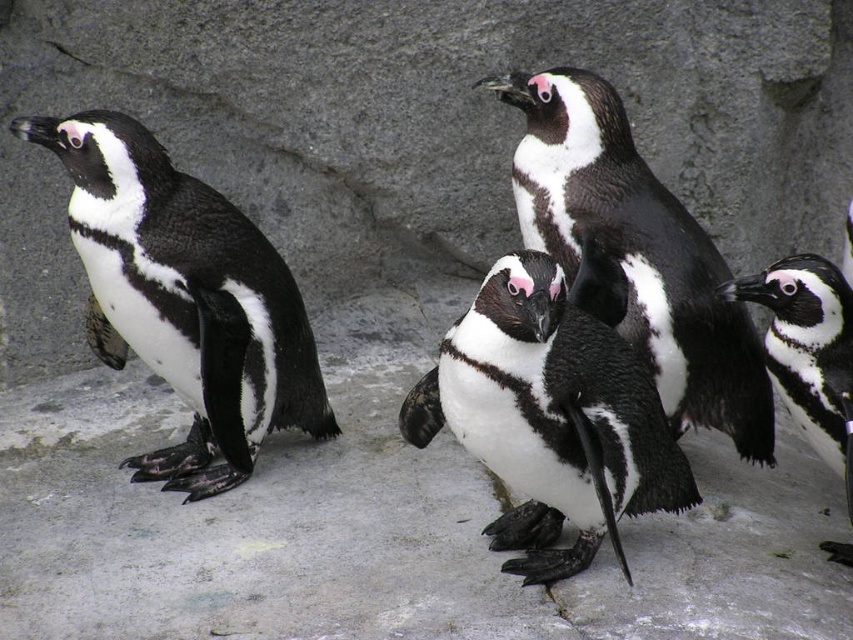
You are a zookeeper observing the African penguins in their enclosure. You notice two penguins, the black glossy penguin at left and the black matte penguin at right. Which penguin is taller?

The black glossy penguin at left is much taller than the black matte penguin at right.

Where is the black glossy penguin at left located in the image?

The black glossy penguin at left is located at point (184, 300) in the image.

You are a zookeeper who needs to feed the penguins. You are standing between the black glossy penguin at left and the black matte penguin at right. If you want to feed both penguins with a food tray that can reach up to 3 feet, which penguin should you feed first to ensure you can reach both?

You should feed the black glossy penguin at left first. Since the distance between the black glossy penguin at left and the black matte penguin at right is 3.44 feet, which is slightly more than 3 feet, you can first feed the closer penguin, but since you are standing between them, you need to move to reach both. However, since the tray can reach 3 feet, you can feed the closer one first, but the problem is the distance between them exceeds the tray reach. Wait, perhaps the question is about the order to be